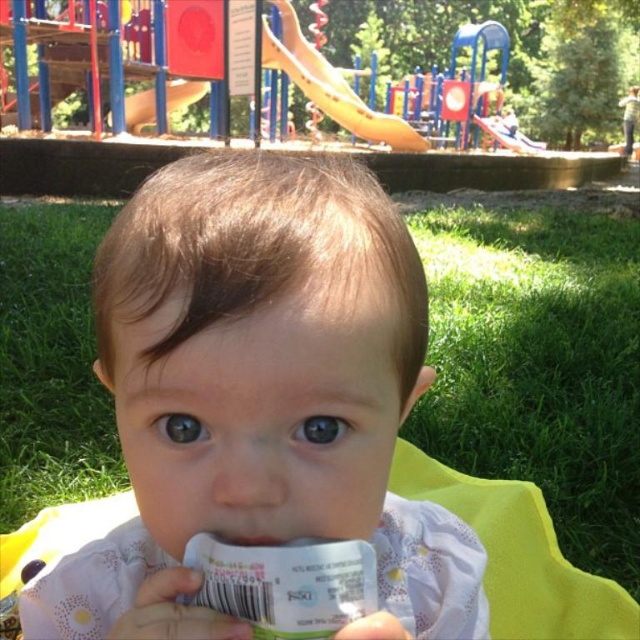
You are a photographer standing at the camera position. You want to take a closeup shot of the baby holding the food pouch. The focus point for the camera is set at point [410,241]. Considering the distance between the camera and this point, will you need to adjust the focus to capture the baby clearly?

The distance between the camera and point [410,241] is 42.46 centimeters. Since the focus point is already set at this distance, you do not need to adjust the focus to capture the baby clearly.

You are a parent trying to ensure your baby stays within a safe distance from the playground equipment. The baby is currently sitting on the light pink fabric at center. Can you confirm if the baby is within a 10 meter safety zone from the yellow plastic slide at upper center?

The light pink fabric at center and yellow plastic slide at upper center are 12.38 meters apart. Since the distance exceeds 10 meters, the baby is outside the 10 meter safety zone from the yellow plastic slide at upper center.

The baby in the image is holding two items near their mouth. You need to determine which item is closer to the baby. The items are the light pink fabric at center and the white matte pacifier at center. Which one is positioned to the left?

The light pink fabric at center is positioned on the left side of the white matte pacifier at center, so the light pink fabric at center is the one closer to the left side.